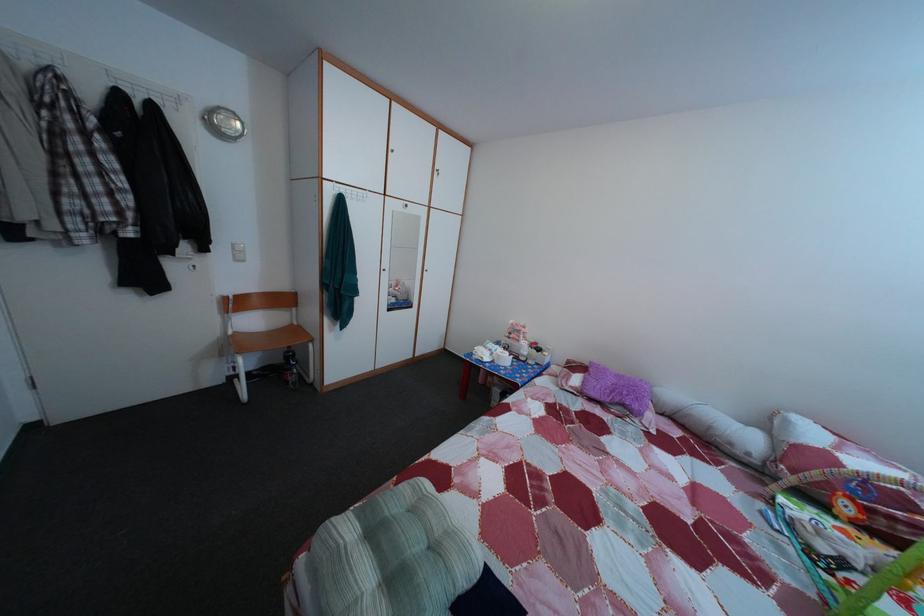
The location [289,368] corresponds to which object?

It corresponds to the black water bottle in the image.